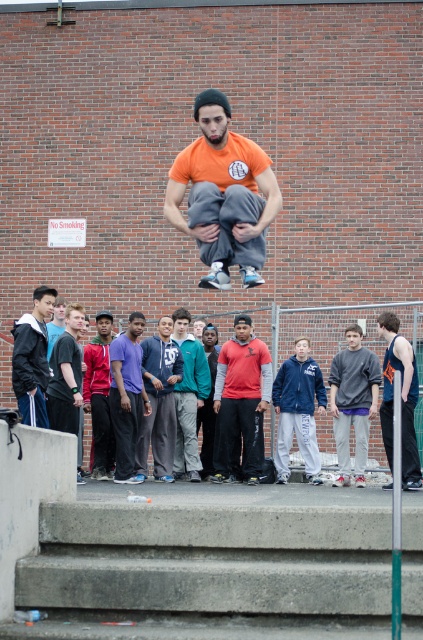
Question: Is gray sweatshirt at center to the left of matte black jacket at lower left from the viewer's perspective?

Choices:
 (A) yes
 (B) no

Answer: (B)

Question: Which point appears farthest from the camera in this image?

Choices:
 (A) (16, 353)
 (B) (236, 230)

Answer: (A)

Question: Does concrete stairs at lower center appear on the right side of navy blue fleece jacket at center?

Choices:
 (A) no
 (B) yes

Answer: (A)

Question: Does blue cotton hoodie at center appear under blue tank top at right?

Choices:
 (A) no
 (B) yes

Answer: (A)

Question: Which object appears farthest from the camera in this image?

Choices:
 (A) concrete stairs at lower center
 (B) red cotton hoodie at center

Answer: (B)

Question: Estimate the real-world distances between objects in this image. Which object is closer to the matte black jacket at lower left?

Choices:
 (A) concrete stairs at lower center
 (B) red cotton hoodie at center

Answer: (A)